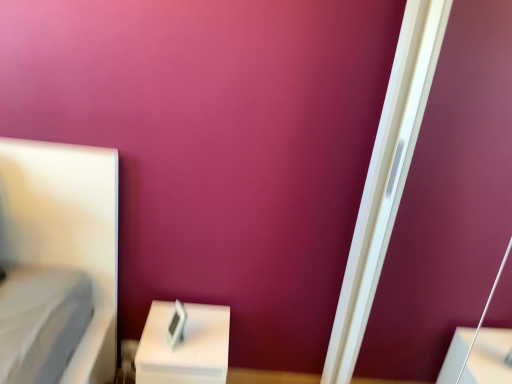
Question: From the image's perspective, is white plastic clock at lower center positioned above or below white glossy screen door at right?

Choices:
 (A) above
 (B) below

Answer: (B)

Question: Which is correct: white plastic clock at lower center is inside white glossy screen door at right, or outside of it?

Choices:
 (A) outside
 (B) inside

Answer: (A)

Question: Is point (142, 349) closer or farther from the camera than point (395, 157)?

Choices:
 (A) closer
 (B) farther

Answer: (B)

Question: Which is correct: white glossy screen door at right is inside white plastic clock at lower center, or outside of it?

Choices:
 (A) outside
 (B) inside

Answer: (A)

Question: In the image, is white glossy screen door at right on the left side or the right side of white plastic clock at lower center?

Choices:
 (A) left
 (B) right

Answer: (B)

Question: Relative to white plastic clock at lower center, is white glossy screen door at right in front or behind?

Choices:
 (A) behind
 (B) front

Answer: (B)

Question: Is white glossy screen door at right bigger or smaller than white plastic clock at lower center?

Choices:
 (A) big
 (B) small

Answer: (A)